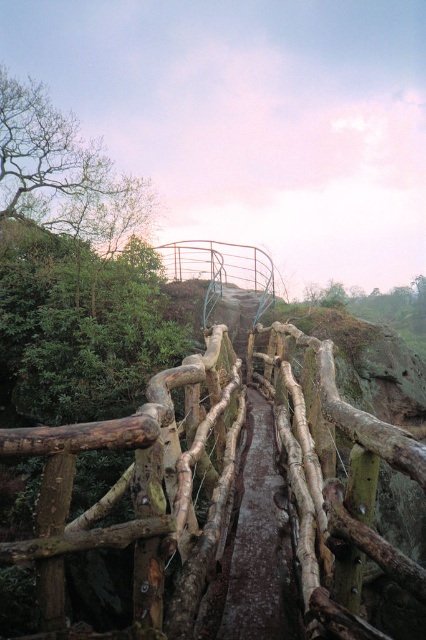
Question: In this image, where is natural wood fence at center located relative to brown rough wooden path at center?

Choices:
 (A) below
 (B) above

Answer: (B)

Question: Can you confirm if natural wood fence at center is bigger than brown rough wooden path at center?

Choices:
 (A) no
 (B) yes

Answer: (A)

Question: Observing the image, what is the correct spatial positioning of natural wood fence at center in reference to brown rough wooden path at center?

Choices:
 (A) above
 (B) below

Answer: (A)

Question: Which point is farther to the camera?

Choices:
 (A) brown rough wooden path at center
 (B) natural wood fence at center

Answer: (A)

Question: Which point is closer to the camera?

Choices:
 (A) natural wood fence at center
 (B) brown rough wooden path at center

Answer: (A)